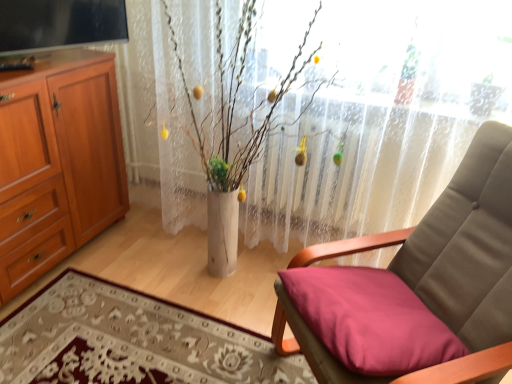
Question: From the image's perspective, is smooth fabric cushion at lower right positioned above or below matte beige cushion at center right?

Choices:
 (A) below
 (B) above

Answer: (A)

Question: Is point (110, 365) closer or farther from the camera than point (459, 168)?

Choices:
 (A) closer
 (B) farther

Answer: (B)

Question: Estimate the real-world distances between objects in this image. Which object is closer to the matte beige cushion at center right?

Choices:
 (A) smooth fabric cushion at lower right
 (B) white sheer curtain at center
 (C) wooden cabinet at left
 (D) matte pink cushion at lower right

Answer: (D)

Question: Considering the real-world distances, which object is closest to the white sheer curtain at center?

Choices:
 (A) matte pink cushion at lower right
 (B) wooden cabinet at left
 (C) smooth fabric cushion at lower right
 (D) matte beige cushion at center right

Answer: (D)